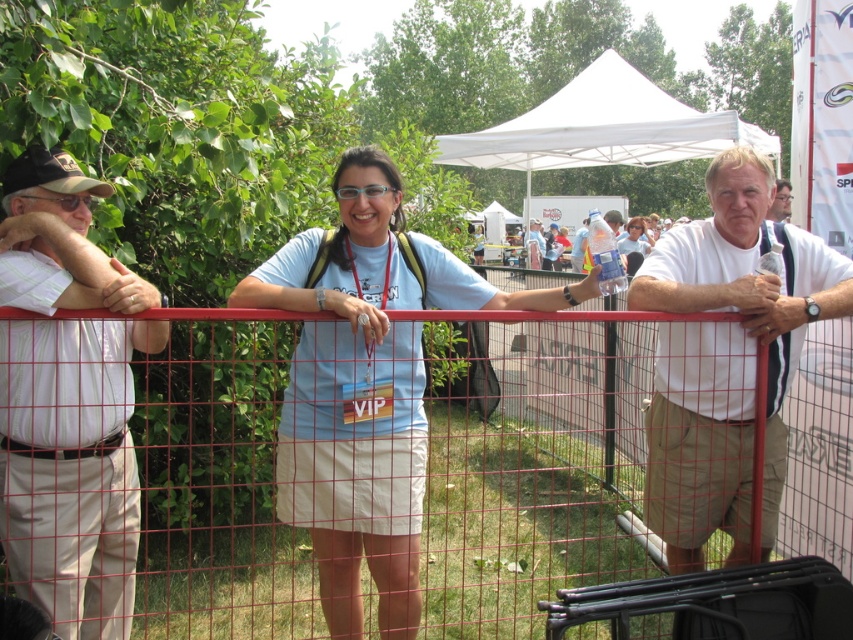
Question: Does white cotton shirt at left have a greater width compared to white t-shirt at center?

Choices:
 (A) yes
 (B) no

Answer: (B)

Question: Which object is farther from the camera taking this photo?

Choices:
 (A) white cotton shirt at left
 (B) matte blue shirt at center
 (C) red mesh fence at center

Answer: (B)

Question: Which of the following is the closest to the observer?

Choices:
 (A) white fabric canopy at upper center
 (B) white cotton shirt at right

Answer: (B)

Question: Does red mesh fence at center appear under white cotton shirt at right?

Choices:
 (A) no
 (B) yes

Answer: (B)

Question: Which point appears closest to the camera in this image?

Choices:
 (A) (639, 236)
 (B) (80, 179)
 (C) (788, 195)
 (D) (538, 122)

Answer: (B)

Question: From the image, what is the correct spatial relationship of white cotton shirt at right in relation to matte blue shirt at center?

Choices:
 (A) right
 (B) left

Answer: (B)